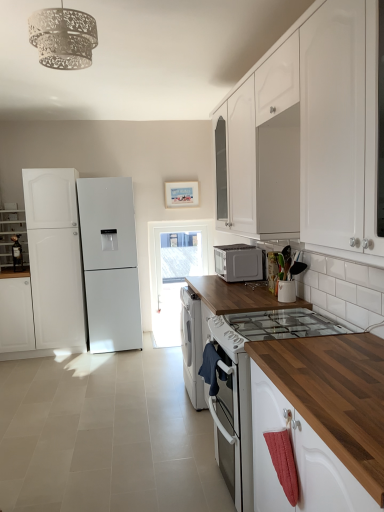
What do you see at coordinates (16, 315) in the screenshot? This screenshot has width=384, height=512. I see `white matte cabinet at left, the fourth cabinetry from the right` at bounding box center [16, 315].

This screenshot has height=512, width=384. I want to click on white paper cutout light fixture at upper center, so click(63, 37).

Measure the distance between point (x=84, y=24) and camera.

The distance of point (x=84, y=24) from camera is 1.69 meters.

What is the approximate width of white matte refrigerator at left?

white matte refrigerator at left is 23.97 inches wide.

You are a GUI agent. You are given a task and a screenshot of the screen. Output one action in this format:
    pyautogui.click(x=<x>, y=<y>)
    Task: Click on the transparent glass door at center
    
    Given the screenshot: What is the action you would take?
    pyautogui.click(x=173, y=273)

Where is `wooden at center`? This screenshot has height=512, width=384. wooden at center is located at coordinates (283, 397).

Locate an element on the screen. The image size is (384, 512). satin silver microwave at center is located at coordinates (238, 262).

From the image's perspective, is white paper cutout light fixture at upper center beneath white matte cabinet at left, which is the 2th cabinetry in back-to-front order?

No, from the image's perspective, white paper cutout light fixture at upper center is not beneath white matte cabinet at left, which is the 2th cabinetry in back-to-front order.

Between white paper cutout light fixture at upper center and white matte cabinet at left, the fourth cabinetry from the right, which one appears on the right side from the viewer's perspective?

From the viewer's perspective, white paper cutout light fixture at upper center appears more on the right side.

Is white paper cutout light fixture at upper center touching white matte cabinet at left, the fourth cabinetry from the right?

white paper cutout light fixture at upper center is not next to white matte cabinet at left, the fourth cabinetry from the right, and they're not touching.

Can you tell me how much white paper cutout light fixture at upper center and white matte cabinet at left, marked as the 1th cabinetry in a left-to-right arrangement, differ in facing direction?

The facing directions of white paper cutout light fixture at upper center and white matte cabinet at left, marked as the 1th cabinetry in a left-to-right arrangement, are 175 degrees apart.

Consider the image. Is white matte refrigerator at left positioned in front of satin silver microwave at center?

No, it is not.

This screenshot has width=384, height=512. What are the coordinates of `refrigerator below the satin silver microwave at center (from a real-world perspective)` in the screenshot? It's located at (55, 258).

From a real-world perspective, is white matte refrigerator at left located higher than satin silver microwave at center?

Incorrect, from a real-world perspective, white matte refrigerator at left is lower than satin silver microwave at center.

Is point (33, 284) closer or farther from the camera than point (256, 279)?

Point (33, 284) is farther from the camera than point (256, 279).

Considering the points (377, 72) and (215, 421), which point is in front, point (377, 72) or point (215, 421)?

The point (377, 72) is more forward.

From a real-world perspective, is white glossy cabinet at upper right, which ranks as the 4th cabinetry in left-to-right order, over wooden at center?

Yes.

Does white glossy cabinet at upper right, arranged as the 1th cabinetry when viewed from the right, have a greater height compared to wooden at center?

Correct, white glossy cabinet at upper right, arranged as the 1th cabinetry when viewed from the right, is much taller as wooden at center.

At what (x,y) coordinates should I click in order to perform the action: click on countertop beneath the white glossy cabinet at upper right, which ranks as the 4th cabinetry in left-to-right order (from a real-world perspective). Please return your answer as a coordinate pair (x, y). The image size is (384, 512). Looking at the image, I should click on (283, 397).

Does transparent glass door at center lie in front of white matte cabinet at left, which is the 2th cabinetry in back-to-front order?

No, transparent glass door at center is further to the viewer.

Based on the photo, which of these two, transparent glass door at center or white matte cabinet at left, marked as the 1th cabinetry in a left-to-right arrangement, is smaller?

With smaller size is transparent glass door at center.

Can you confirm if transparent glass door at center is wider than white matte cabinet at left, marked as the 1th cabinetry in a left-to-right arrangement?

No, transparent glass door at center is not wider than white matte cabinet at left, marked as the 1th cabinetry in a left-to-right arrangement.

Is transparent glass door at center completely or partially outside of white matte cabinet at left, which is the 2th cabinetry in back-to-front order?

That's correct, transparent glass door at center is outside of white matte cabinet at left, which is the 2th cabinetry in back-to-front order.

How different are the orientations of white paper cutout light fixture at upper center and white matte cabinet at upper center, which is counted as the 3th cabinetry, starting from the back, in degrees?

They differ by 85.2 degrees in their facing directions.

Does white paper cutout light fixture at upper center turn towards white matte cabinet at upper center, the second cabinetry viewed from the front?

No, white paper cutout light fixture at upper center does not turn towards white matte cabinet at upper center, the second cabinetry viewed from the front.

From a real-world perspective, is white paper cutout light fixture at upper center physically located above or below white matte cabinet at upper center, which ranks as the 3th cabinetry in left-to-right order?

Answer: In terms of real-world spatial position, white paper cutout light fixture at upper center is above white matte cabinet at upper center, which ranks as the 3th cabinetry in left-to-right order.

Which object is further away from the camera, white paper cutout light fixture at upper center or white matte cabinet at upper center, which appears as the second cabinetry when viewed from the right?

white matte cabinet at upper center, which appears as the second cabinetry when viewed from the right, is behind.

Looking at this image, is white paper cutout light fixture at upper center oriented away from matte white cabinet at left, placed as the 4th cabinetry when sorted from front to back?

No, white paper cutout light fixture at upper center is not facing away from matte white cabinet at left, placed as the 4th cabinetry when sorted from front to back.

Consider the image. Between white paper cutout light fixture at upper center and matte white cabinet at left, which is the 2th cabinetry from left to right, which one appears on the left side from the viewer's perspective?

From the viewer's perspective, matte white cabinet at left, which is the 2th cabinetry from left to right, appears more on the left side.

Is white paper cutout light fixture at upper center not near matte white cabinet at left, acting as the third cabinetry starting from the right?

Yes, white paper cutout light fixture at upper center and matte white cabinet at left, acting as the third cabinetry starting from the right, are located far from each other.

Which of these two, white paper cutout light fixture at upper center or matte white cabinet at left, placed as the 4th cabinetry when sorted from front to back, stands taller?

Standing taller between the two is matte white cabinet at left, placed as the 4th cabinetry when sorted from front to back.

Considering the sizes of objects white matte cabinet at upper center, which is counted as the 3th cabinetry, starting from the back, and satin silver microwave at center in the image provided, who is wider, white matte cabinet at upper center, which is counted as the 3th cabinetry, starting from the back, or satin silver microwave at center?

white matte cabinet at upper center, which is counted as the 3th cabinetry, starting from the back.

From a real-world perspective, which object rests below the other?

satin silver microwave at center, from a real-world perspective.

Can satin silver microwave at center be found inside white matte cabinet at upper center, which appears as the second cabinetry when viewed from the right?

No.

Locate an element on the screen. light fixture to the right of white matte cabinet at left, which is the 2th cabinetry in back-to-front order is located at coordinates (63, 37).

At what (x,y) coordinates should I click in order to perform the action: click on microwave oven above the white matte refrigerator at left (from the image's perspective). Please return your answer as a coordinate pair (x, y). Looking at the image, I should click on (238, 262).

Looking at this image, based on their spatial positions, is white matte cabinet at left, the fourth cabinetry from the right, or white matte refrigerator at left closer to white matte cabinet at upper center, which ranks as the 3th cabinetry in left-to-right order?

white matte refrigerator at left lies closer to white matte cabinet at upper center, which ranks as the 3th cabinetry in left-to-right order, than the other object.

From the image, which object appears to be farther from white glossy cabinet at upper right, arranged as the 1th cabinetry when viewed from the right, matte white cabinet at left, which is the 2th cabinetry from left to right, or transparent glass door at center?

The object further to white glossy cabinet at upper right, arranged as the 1th cabinetry when viewed from the right, is matte white cabinet at left, which is the 2th cabinetry from left to right.

Considering their positions, is white paper cutout light fixture at upper center positioned closer to white matte cabinet at left, the fourth cabinetry from the right, than transparent glass door at center?

transparent glass door at center is closer to white matte cabinet at left, the fourth cabinetry from the right.

When comparing their distances from transparent glass door at center, does matte white cabinet at left, placed as the 4th cabinetry when sorted from front to back, or white paper cutout light fixture at upper center seem further?

Based on the image, white paper cutout light fixture at upper center appears to be further to transparent glass door at center.

Which object lies further to the anchor point white glossy cabinet at upper right, which ranks as the 4th cabinetry in left-to-right order, white matte cabinet at upper center, which ranks as the 3th cabinetry in left-to-right order, or white matte refrigerator at left?

white matte refrigerator at left is further to white glossy cabinet at upper right, which ranks as the 4th cabinetry in left-to-right order.

Which object lies nearer to the anchor point transparent glass door at center, white matte cabinet at upper center, which ranks as the 3th cabinetry in left-to-right order, or matte white cabinet at left, which is the 2th cabinetry from left to right?

matte white cabinet at left, which is the 2th cabinetry from left to right, lies closer to transparent glass door at center than the other object.

When comparing their distances from white matte cabinet at left, the fourth cabinetry from the right, does white matte cabinet at upper center, the second cabinetry viewed from the front, or white glossy cabinet at upper right, which ranks as the 4th cabinetry in left-to-right order, seem closer?

Among the two, white matte cabinet at upper center, the second cabinetry viewed from the front, is located nearer to white matte cabinet at left, the fourth cabinetry from the right.

Based on their spatial positions, is white paper cutout light fixture at upper center or satin silver microwave at center further from white matte cabinet at upper center, which appears as the second cabinetry when viewed from the right?

The object further to white matte cabinet at upper center, which appears as the second cabinetry when viewed from the right, is white paper cutout light fixture at upper center.

The image size is (384, 512). In order to click on cabinetry between white glossy cabinet at upper right, arranged as the 1th cabinetry when viewed from the right, and white matte cabinet at left, marked as the 1th cabinetry in a left-to-right arrangement, from front to back in this screenshot , I will do `click(261, 150)`.

The image size is (384, 512). Find the location of `glass door between white matte cabinet at left, which is the 2th cabinetry in back-to-front order, and satin silver microwave at center`. glass door between white matte cabinet at left, which is the 2th cabinetry in back-to-front order, and satin silver microwave at center is located at coordinates (173, 273).

The width and height of the screenshot is (384, 512). I want to click on countertop between white paper cutout light fixture at upper center and white matte refrigerator at left from front to back, so click(283, 397).

You are a GUI agent. You are given a task and a screenshot of the screen. Output one action in this format:
    pyautogui.click(x=<x>, y=<y>)
    Task: Click on the refrigerator between matte white cabinet at left, placed as the 4th cabinetry when sorted from front to back, and satin silver microwave at center
    This screenshot has width=384, height=512.
    Given the screenshot: What is the action you would take?
    pyautogui.click(x=55, y=258)